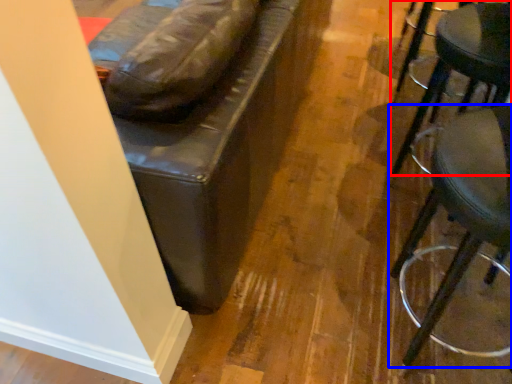
Question: Which point is further to the camera, stool (highlighted by a red box) or stool (highlighted by a blue box)?

Choices:
 (A) stool
 (B) stool

Answer: (A)